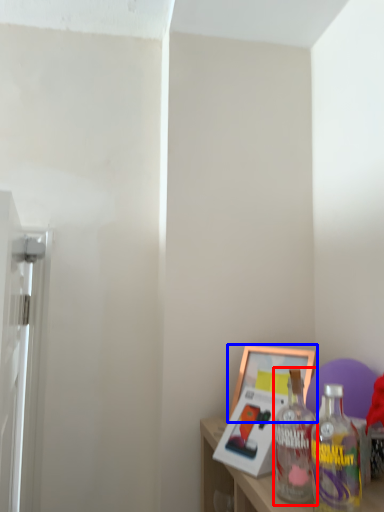
Question: Which point is further to the camera, bottle (highlighted by a red box) or picture frame (highlighted by a blue box)?

Choices:
 (A) bottle
 (B) picture frame

Answer: (B)